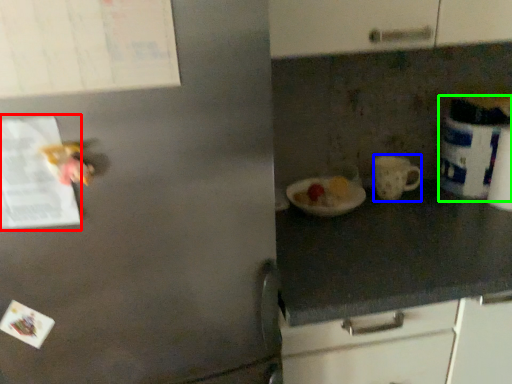
Question: Which object is the closest to the paper (highlighted by a red box)? Choose among these: mug (highlighted by a blue box) or appliance (highlighted by a green box).

Choices:
 (A) mug
 (B) appliance

Answer: (A)